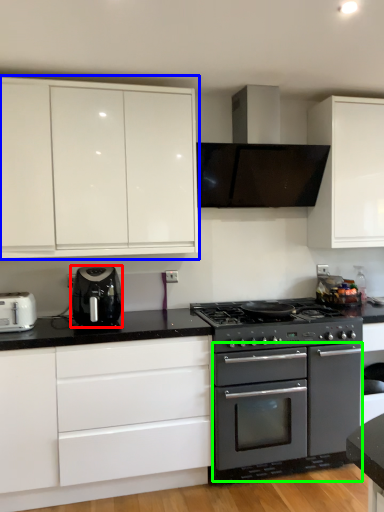
Question: Considering the real-world distances, which object is closest to kitchen appliance (highlighted by a red box)? cabinetry (highlighted by a blue box) or oven (highlighted by a green box).

Choices:
 (A) cabinetry
 (B) oven

Answer: (A)